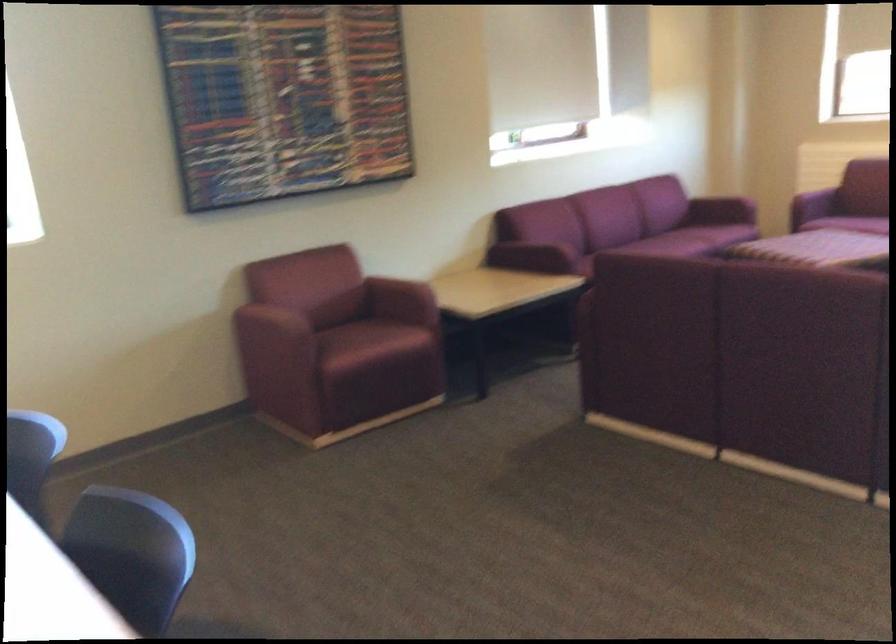
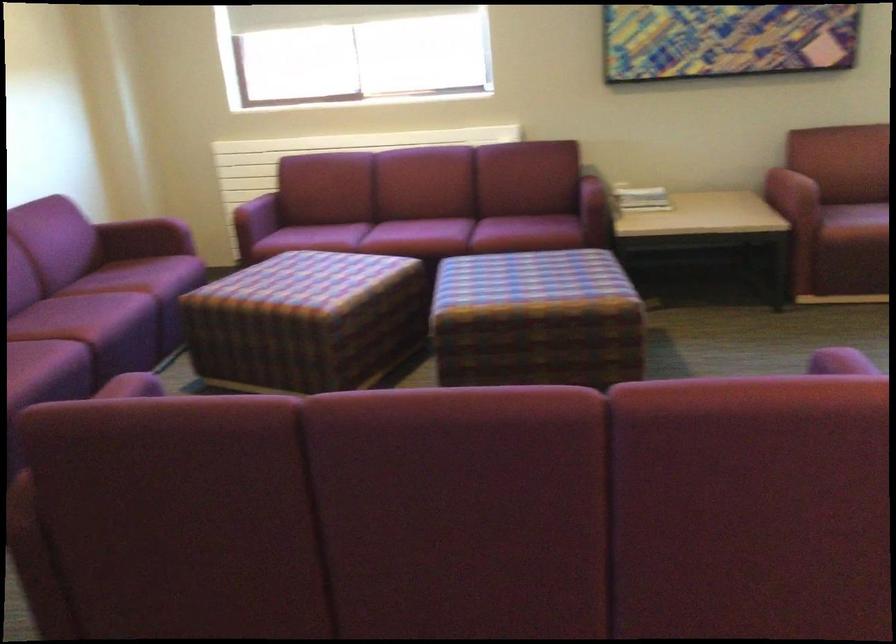
Where in the second image is the point corresponding to pixel 682 252 from the first image?

(116, 313)